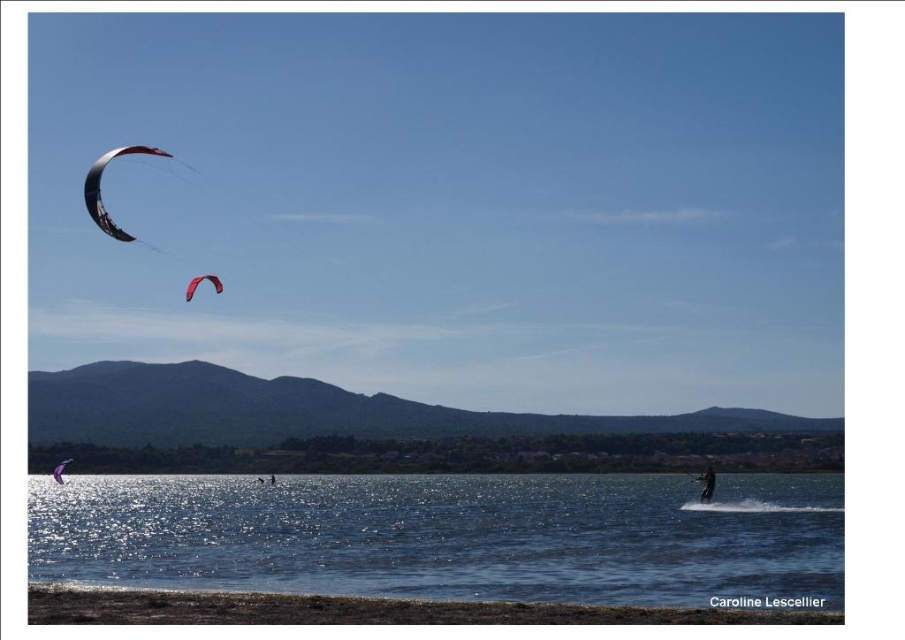
You are a photographer planning to capture the clear blue water at lower center and the red matte parachute at upper left in a single shot. Which object will occupy a larger portion of the frame?

The clear blue water at lower center will occupy a larger portion of the frame because its width surpasses that of the red matte parachute at upper left.

You are standing at the origin point of the image. Which point, point (x=99, y=195) or point (x=189, y=300), is closer to you?

Point (x=99, y=195) is in front of point (x=189, y=300), so it is closer to you.

Looking at this image, you are a photographer planning to capture the scene with a wide angle lens. You want to ensure both the matte black parachute at upper left and the matte purple kite at lower left are fully visible in the frame. Given their sizes and positions, which object will appear bigger in your photo?

The matte black parachute at upper left will appear bigger in the photo because it has a larger size compared to the matte purple kite at lower left.